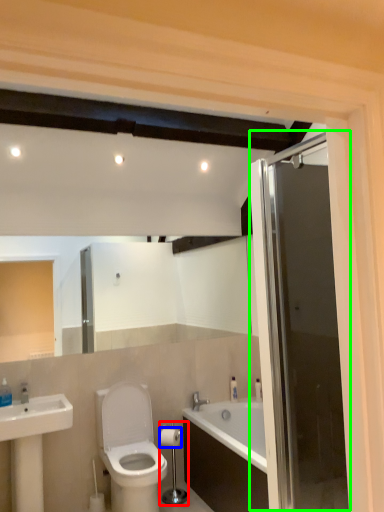
Question: Considering the real-world distances, which object is farthest from towel bar (highlighted by a red box)? toilet paper (highlighted by a blue box) or door (highlighted by a green box)?

Choices:
 (A) toilet paper
 (B) door

Answer: (B)